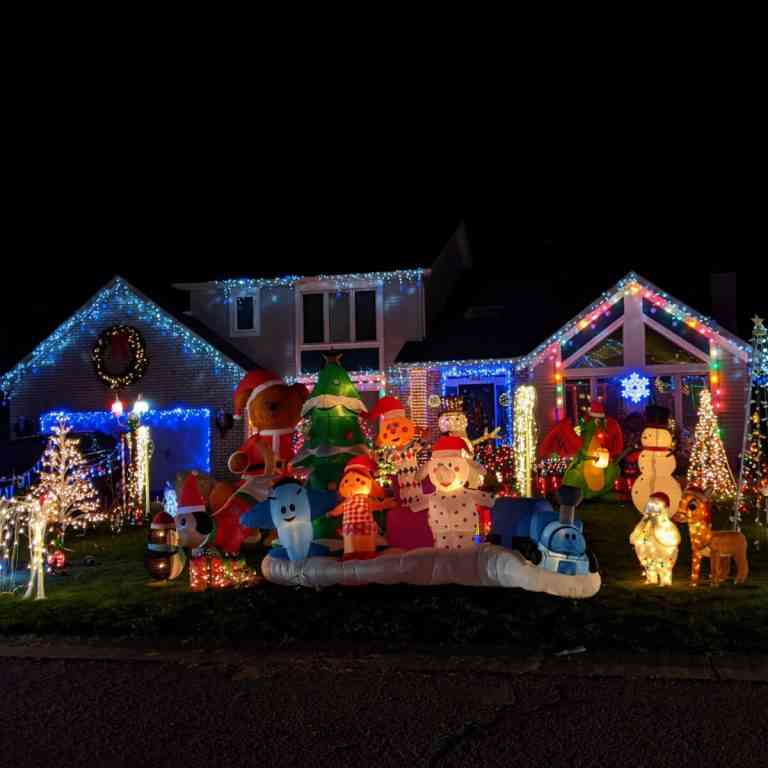
Where is `door`? Image resolution: width=768 pixels, height=768 pixels. door is located at coordinates (472, 411).